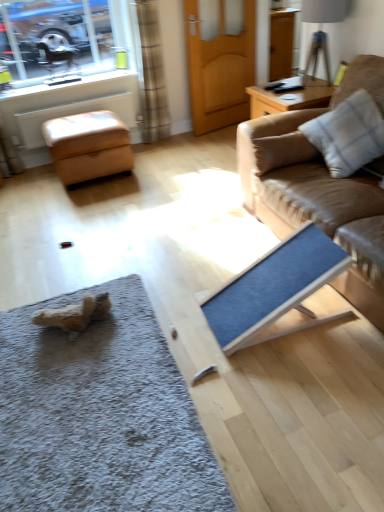
This screenshot has width=384, height=512. I want to click on free space in front of blue fabric yoga mat at center, so click(296, 387).